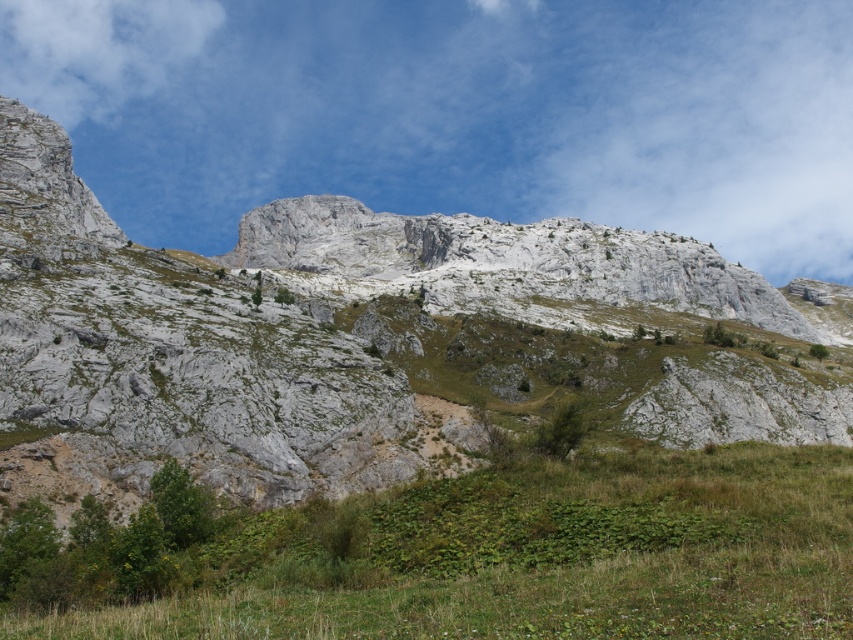
You are a hiker standing at the lower part of the mountain. You see two points marked on the map as point (91, 225) and point (160, 598). Which point is closer to you?

Point (160, 598) is closer to you because it is in front of point (91, 225).

You are a hiker standing at the base of the gray rock mountain at center. You want to reach the summit. If your average hiking pace is 3 km per hour, how long will it take you to reach the summit?

The gray rock mountain at center and viewer are 71.33 meters apart. At an average hiking pace of 3 km per hour, it would take approximately 1.43 minutes to reach the summit.